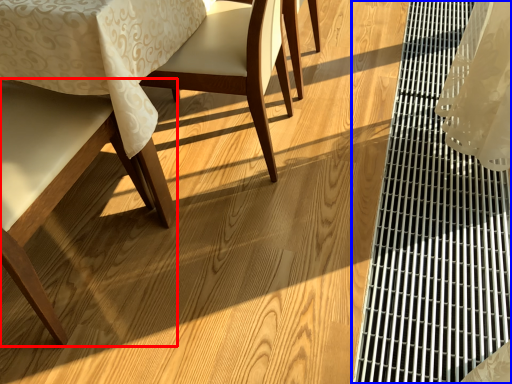
Question: Among these objects, which one is nearest to the camera, chair (highlighted by a red box) or table (highlighted by a blue box)?

Choices:
 (A) chair
 (B) table

Answer: (A)